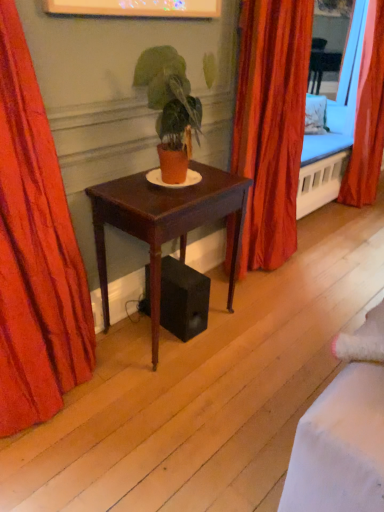
Question: Is orange fabric curtain at right, placed as the third curtain when sorted from left to right, next to silky orange curtain at center, which ranks as the second curtain in right-to-left order?

Choices:
 (A) yes
 (B) no

Answer: (B)

Question: Can you confirm if orange fabric curtain at right, placed as the third curtain when sorted from left to right, is thinner than silky orange curtain at center, which appears as the 2th curtain when viewed from the left?

Choices:
 (A) yes
 (B) no

Answer: (A)

Question: Is orange fabric curtain at right, the 1th curtain positioned from the back, taller than silky orange curtain at center, which appears as the 2th curtain when viewed from the left?

Choices:
 (A) no
 (B) yes

Answer: (B)

Question: Is orange fabric curtain at right, placed as the third curtain when sorted from left to right, closer to camera compared to silky orange curtain at center, which appears as the 2th curtain when viewed from the left?

Choices:
 (A) no
 (B) yes

Answer: (A)

Question: From a real-world perspective, is orange fabric curtain at right, the 1th curtain positioned from the back, over silky orange curtain at center, which ranks as the second curtain in right-to-left order?

Choices:
 (A) no
 (B) yes

Answer: (B)

Question: Is mahogany wood desk at center wider or thinner than matte orange pot at center?

Choices:
 (A) wide
 (B) thin

Answer: (A)

Question: From the image's perspective, is mahogany wood desk at center positioned above or below matte orange pot at center?

Choices:
 (A) above
 (B) below

Answer: (B)

Question: From their relative heights in the image, would you say mahogany wood desk at center is taller or shorter than matte orange pot at center?

Choices:
 (A) tall
 (B) short

Answer: (A)

Question: Based on their positions, is mahogany wood desk at center located to the left or right of matte orange pot at center?

Choices:
 (A) left
 (B) right

Answer: (A)

Question: Looking at their shapes, would you say mahogany wood desk at center is wider or thinner than orange fabric curtain at right, which ranks as the 3th curtain in front-to-back order?

Choices:
 (A) wide
 (B) thin

Answer: (A)

Question: Is mahogany wood desk at center inside the boundaries of orange fabric curtain at right, arranged as the 1th curtain when viewed from the right, or outside?

Choices:
 (A) outside
 (B) inside

Answer: (A)

Question: Considering their positions, is mahogany wood desk at center located in front of or behind orange fabric curtain at right, the 1th curtain positioned from the back?

Choices:
 (A) front
 (B) behind

Answer: (A)

Question: In terms of height, does mahogany wood desk at center look taller or shorter compared to orange fabric curtain at right, which ranks as the 3th curtain in front-to-back order?

Choices:
 (A) short
 (B) tall

Answer: (A)

Question: From a real-world perspective, is orange fabric curtain at right, which ranks as the 3th curtain in front-to-back order, above or below velvet red curtain at left, the third curtain in the back-to-front sequence?

Choices:
 (A) above
 (B) below

Answer: (A)

Question: Is orange fabric curtain at right, arranged as the 1th curtain when viewed from the right, wider or thinner than velvet red curtain at left, the third curtain in the back-to-front sequence?

Choices:
 (A) thin
 (B) wide

Answer: (B)